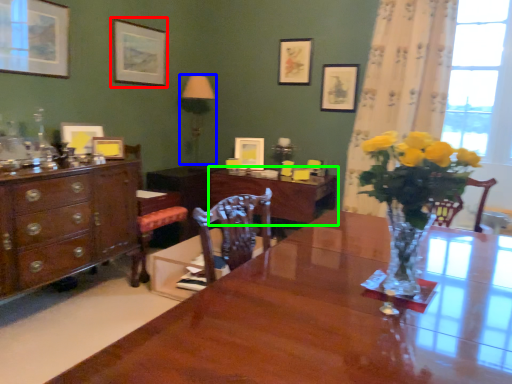
Question: Which object is positioned closest to picture frame (highlighted by a red box)? Select from lamp (highlighted by a blue box) and table (highlighted by a green box).

Choices:
 (A) lamp
 (B) table

Answer: (A)